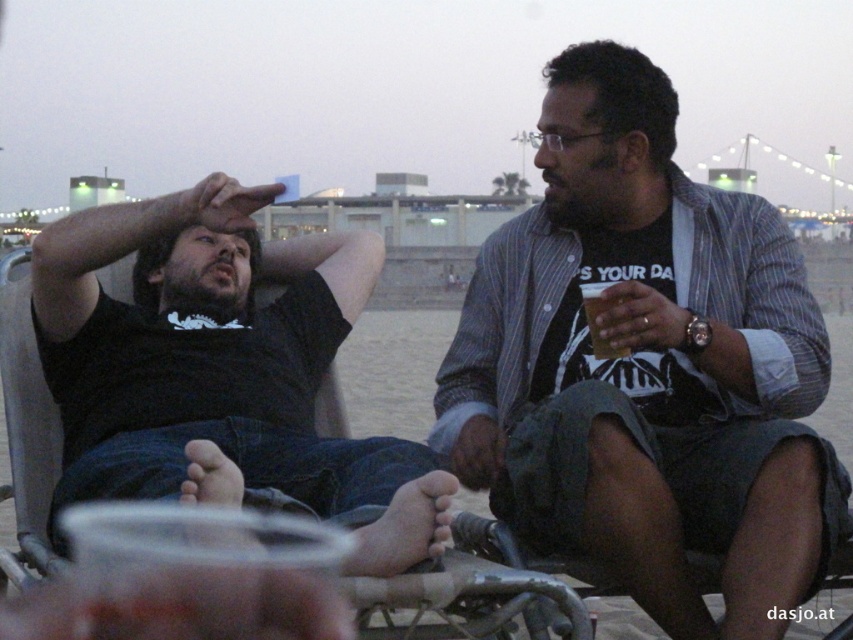
Does matte black shirt at center have a lesser height compared to translucent plastic cup at right?

No, matte black shirt at center is not shorter than translucent plastic cup at right.

From the picture: Can you confirm if matte black shirt at center is positioned above translucent plastic cup at right?

No.

Between point (779, 410) and point (592, 310), which one is positioned behind?

The point (779, 410) is more distant.

In order to click on matte black shirt at center in this screenshot , I will do `click(646, 365)`.

Who is taller, matte black shirt at center or black matte shirt at left?

With more height is matte black shirt at center.

Does point (550, 72) come closer to viewer compared to point (265, 436)?

No, (550, 72) is further to viewer.

Image resolution: width=853 pixels, height=640 pixels. Find the location of `matte black shirt at center`. matte black shirt at center is located at coordinates (646, 365).

From the picture: Between black matte shirt at left and translucent plastic cup at right, which one is positioned higher?

black matte shirt at left

Locate an element on the screen. This screenshot has height=640, width=853. black matte shirt at left is located at coordinates (206, 298).

You are a GUI agent. You are given a task and a screenshot of the screen. Output one action in this format:
    pyautogui.click(x=<x>, y=<y>)
    Task: Click on the black matte shirt at left
    This screenshot has height=640, width=853.
    Given the screenshot: What is the action you would take?
    pyautogui.click(x=206, y=298)

The height and width of the screenshot is (640, 853). I want to click on black matte shirt at left, so click(x=206, y=298).